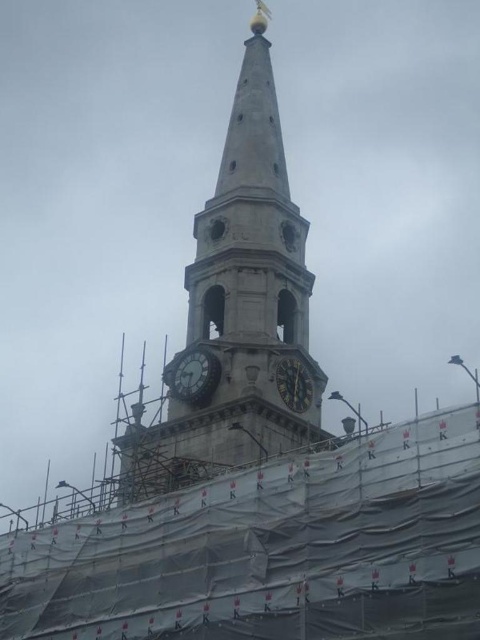
Question: Which of the following is the closest to the observer?

Choices:
 (A) dark gray stone clock at center
 (B) stone clock tower at center
 (C) gold textured clock at center

Answer: (B)

Question: Is stone clock tower at center smaller than dark gray stone clock at center?

Choices:
 (A) no
 (B) yes

Answer: (A)

Question: Does stone clock tower at center have a greater width compared to gold textured clock at center?

Choices:
 (A) no
 (B) yes

Answer: (B)

Question: Which object is the closest to the stone clock tower at center?

Choices:
 (A) gold textured clock at center
 (B) dark gray stone clock at center

Answer: (A)

Question: Is dark gray stone clock at center smaller than gold textured clock at center?

Choices:
 (A) no
 (B) yes

Answer: (B)

Question: Which object is positioned closest to the dark gray stone clock at center?

Choices:
 (A) gold textured clock at center
 (B) stone clock tower at center

Answer: (A)